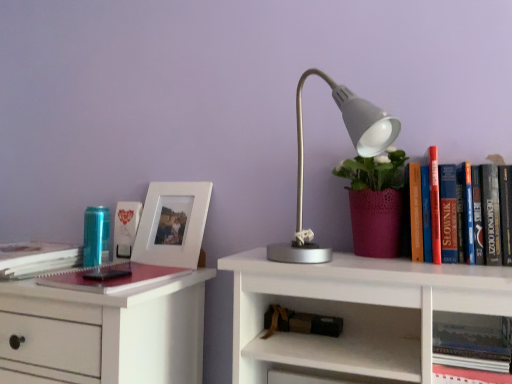
Question: Is matte white photo frame at left, marked as the 5th book in a bottom-to-top arrangement, bigger than brown leather book at lower center, positioned as the 4th book in top-to-bottom order?

Choices:
 (A) no
 (B) yes

Answer: (A)

Question: From the image's perspective, is matte white photo frame at left, which ranks as the 2th book in left-to-right order, over brown leather book at lower center, which ranks as the 4th book in left-to-right order?

Choices:
 (A) no
 (B) yes

Answer: (B)

Question: Is matte white photo frame at left, positioned as the fourth book in right-to-left order, further to the viewer compared to brown leather book at lower center, positioned as the second book in right-to-left order?

Choices:
 (A) yes
 (B) no

Answer: (A)

Question: Is brown leather book at lower center, which ranks as the 4th book in left-to-right order, inside matte white photo frame at left, which ranks as the 2th book in left-to-right order?

Choices:
 (A) no
 (B) yes

Answer: (A)

Question: Can you see matte white photo frame at left, marked as the 5th book in a bottom-to-top arrangement, touching brown leather book at lower center, positioned as the 4th book in top-to-bottom order?

Choices:
 (A) no
 (B) yes

Answer: (A)

Question: From the image's perspective, is hardcover book at upper right, which is the 1th book from bottom to top, above or below hardcover book at left, which ranks as the second book in top-to-bottom order?

Choices:
 (A) below
 (B) above

Answer: (A)

Question: Which is correct: hardcover book at upper right, which ranks as the fifth book in top-to-bottom order, is inside hardcover book at left, which appears as the 1th book when viewed from the left, or outside of it?

Choices:
 (A) outside
 (B) inside

Answer: (A)

Question: Based on their positions, is hardcover book at upper right, the fifth book when ordered from left to right, located to the left or right of hardcover book at left, which ranks as the second book in top-to-bottom order?

Choices:
 (A) right
 (B) left

Answer: (A)

Question: From a real-world perspective, is hardcover book at upper right, which is the 1th book from bottom to top, above or below hardcover book at left, the fifth book positioned from the right?

Choices:
 (A) below
 (B) above

Answer: (A)

Question: Based on their sizes in the image, would you say hardcover book at left, the fifth book positioned from the right, is bigger or smaller than brown leather book at lower center, marked as the 2th book in a bottom-to-top arrangement?

Choices:
 (A) small
 (B) big

Answer: (B)

Question: Choose the correct answer: Is hardcover book at left, which ranks as the second book in top-to-bottom order, inside brown leather book at lower center, positioned as the 4th book in top-to-bottom order, or outside it?

Choices:
 (A) inside
 (B) outside

Answer: (B)

Question: Based on their positions, is hardcover book at left, which ranks as the second book in top-to-bottom order, located to the left or right of brown leather book at lower center, marked as the 2th book in a bottom-to-top arrangement?

Choices:
 (A) right
 (B) left

Answer: (B)

Question: From a real-world perspective, relative to brown leather book at lower center, which ranks as the 4th book in left-to-right order, is hardcover book at left, the fifth book positioned from the right, vertically above or below?

Choices:
 (A) above
 (B) below

Answer: (A)

Question: Considering the positions of hardcover book at left, positioned as the fourth book in bottom-to-top order, and matte red notebook at left, which appears as the 3th book when viewed from the left, in the image, is hardcover book at left, positioned as the fourth book in bottom-to-top order, wider or thinner than matte red notebook at left, which appears as the 3th book when viewed from the left,?

Choices:
 (A) thin
 (B) wide

Answer: (A)

Question: Would you say hardcover book at left, which appears as the 1th book when viewed from the left, is to the left or to the right of matte red notebook at left, marked as the 3th book in a right-to-left arrangement, in the picture?

Choices:
 (A) left
 (B) right

Answer: (A)